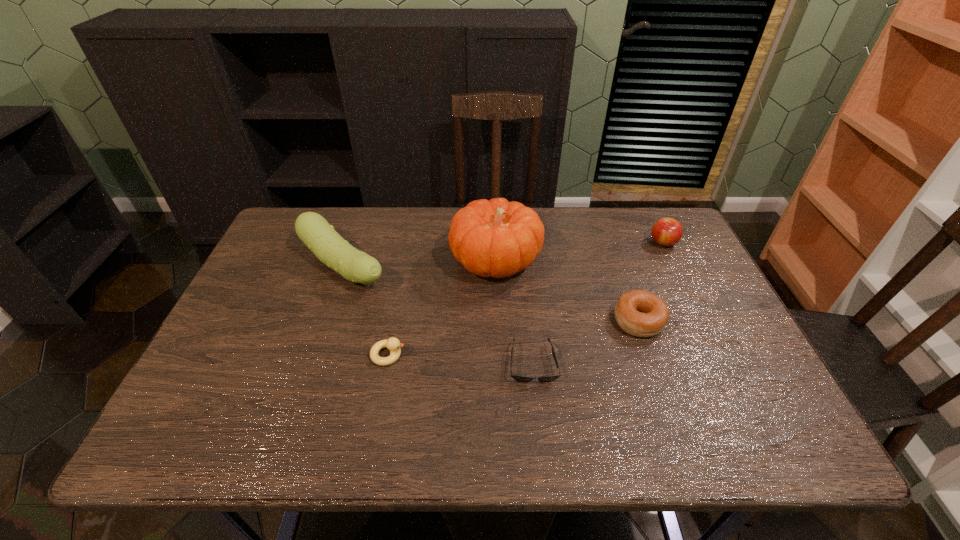
The image size is (960, 540). In order to click on free space that satisfies the following two spatial constraints: 1. on the front side of the cucumber; 2. on the right side of the fifth object from left to right in this screenshot , I will do `click(324, 321)`.